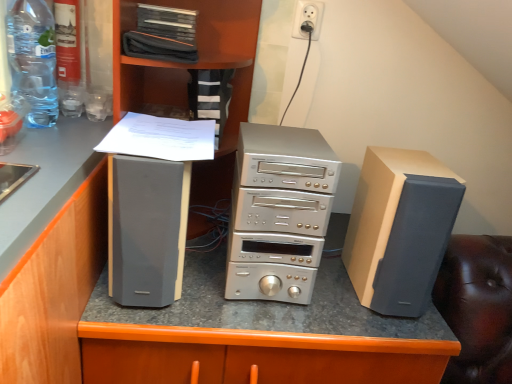
Locate an element on the screen. The width and height of the screenshot is (512, 384). vacant space situated above silver metallic stereo stack at center (from a real-world perspective) is located at coordinates (288, 141).